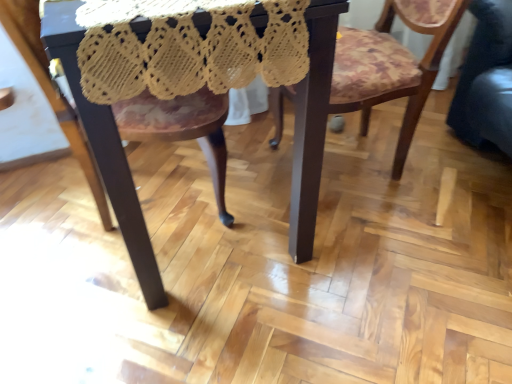
This screenshot has width=512, height=384. Identify the location of free location to the right of dark brown polished wood table at center. (417, 214).